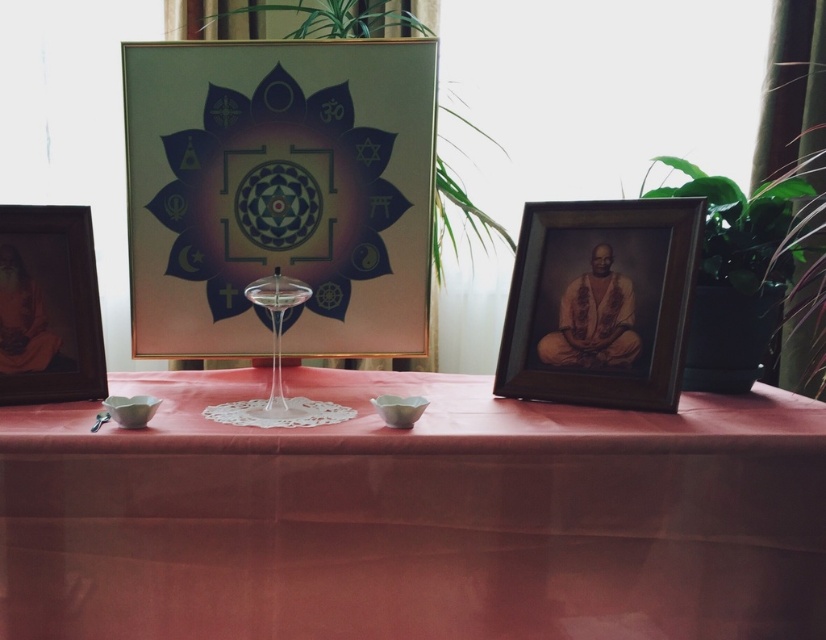
Looking at this image, between smooth glossy tablecloth at center and transparent glass wine glass at center, which one is positioned higher?

Positioned higher is transparent glass wine glass at center.

Can you confirm if smooth glossy tablecloth at center is bigger than transparent glass wine glass at center?

Indeed, smooth glossy tablecloth at center has a larger size compared to transparent glass wine glass at center.

Who is more distant from viewer, (782, 481) or (263, 406)?

The point (263, 406) is behind.

This screenshot has width=826, height=640. What are the coordinates of `smooth glossy tablecloth at center` in the screenshot? It's located at (413, 516).

Does matte wooden picture frame at left have a greater width compared to green leafy plant at upper center?

No.

Between matte wooden picture frame at left and green leafy plant at upper center, which one has more height?

Standing taller between the two is green leafy plant at upper center.

The width and height of the screenshot is (826, 640). What are the coordinates of `matte wooden picture frame at left` in the screenshot? It's located at (48, 305).

Locate an element on the screen. This screenshot has height=640, width=826. matte wooden picture frame at left is located at coordinates (48, 305).

Between wooden framed portrait at right and transparent glass wine glass at center, which one appears on the right side from the viewer's perspective?

wooden framed portrait at right is more to the right.

Is point (582, 236) behind point (288, 307)?

Yes, it is behind point (288, 307).

Which is behind, point (627, 374) or point (274, 339)?

The point (274, 339) is behind.

At what (x,y) coordinates should I click in order to perform the action: click on wooden framed portrait at right. Please return your answer as a coordinate pair (x, y). Looking at the image, I should click on (601, 301).